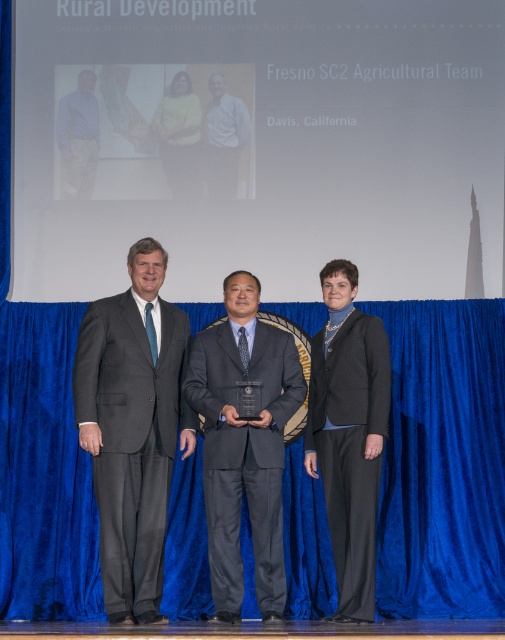
Does black wool suit at center appear on the right side of matte blue shirt at left?

Correct, you'll find black wool suit at center to the right of matte blue shirt at left.

Between black wool suit at center and matte blue shirt at left, which one has more height?

With more height is black wool suit at center.

The image size is (505, 640). Find the location of `black wool suit at center`. black wool suit at center is located at coordinates (350, 449).

Identify the location of black wool suit at center. (350, 449).

Can you confirm if matte gray suit at center is smaller than matte blue shirt at left?

No, matte gray suit at center is not smaller than matte blue shirt at left.

Find the location of a particular element. The image size is (505, 640). matte gray suit at center is located at coordinates (224, 140).

Is blue velvet curtain at center to the right of matte blue shirt at left from the viewer's perspective?

Correct, you'll find blue velvet curtain at center to the right of matte blue shirt at left.

Is point (197, 564) less distant than point (61, 138)?

Yes, point (197, 564) is closer to viewer.

Where is `blue velvet curtain at center`? The height and width of the screenshot is (640, 505). blue velvet curtain at center is located at coordinates (442, 460).